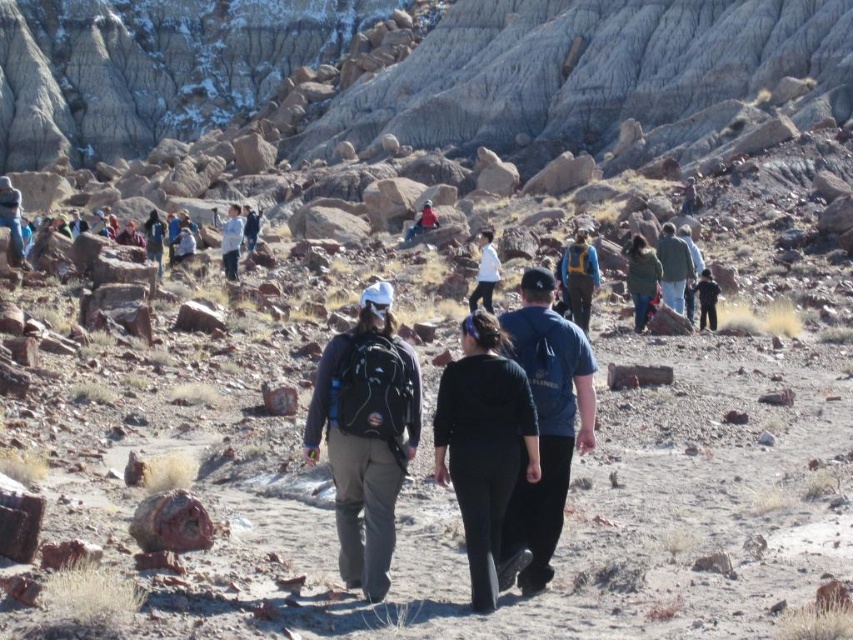
Is blue fabric shirt at center taller than matte black backpack at left?

Correct, blue fabric shirt at center is much taller as matte black backpack at left.

Does blue fabric shirt at center have a greater width compared to matte black backpack at left?

No.

Describe the element at coordinates (546, 422) in the screenshot. I see `blue fabric shirt at center` at that location.

Where is `blue fabric shirt at center`? The height and width of the screenshot is (640, 853). blue fabric shirt at center is located at coordinates (546, 422).

Consider the image. Can you confirm if matte black backpack at center is bigger than blue backpack at center?

No.

Does matte black backpack at center have a greater width compared to blue backpack at center?

Indeed, matte black backpack at center has a greater width compared to blue backpack at center.

Who is more forward, (347, 518) or (589, 308)?

Point (347, 518) is more forward.

Locate an element on the screen. This screenshot has width=853, height=640. matte black backpack at center is located at coordinates (366, 436).

Can you confirm if blue backpack at center is shorter than green matte jacket at center-right?

→ No, blue backpack at center is not shorter than green matte jacket at center-right.

Does blue backpack at center have a lesser width compared to green matte jacket at center-right?

Yes, blue backpack at center is thinner than green matte jacket at center-right.

Identify the location of blue backpack at center. Image resolution: width=853 pixels, height=640 pixels. (579, 276).